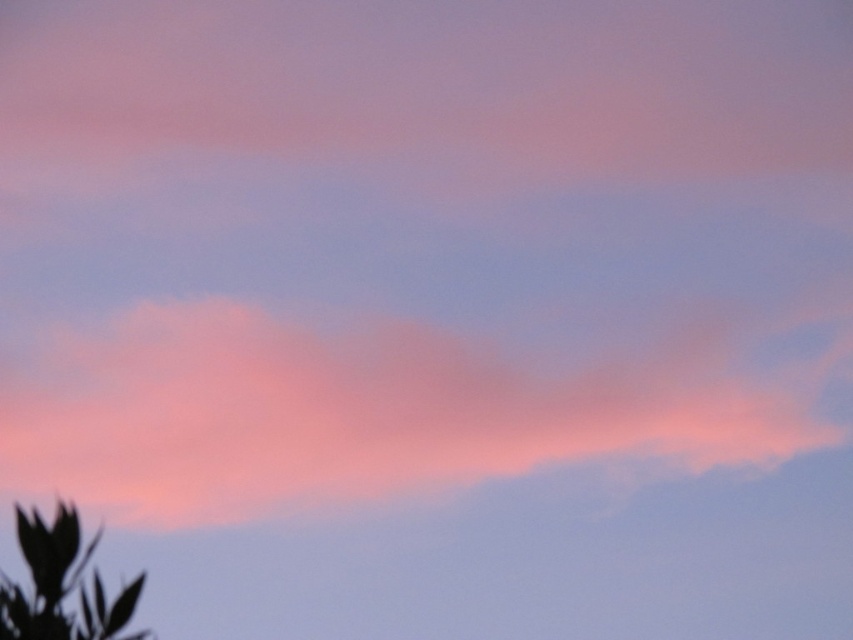
You are an artist trying to paint the scene. You want to ensure the pink fluffy cloud at center and silhouette leaf at lower left are proportionally accurate. Based on the scene, which object should you draw wider?

The pink fluffy cloud at center should be drawn wider since it is wider than the silhouette leaf at lower left according to the description.